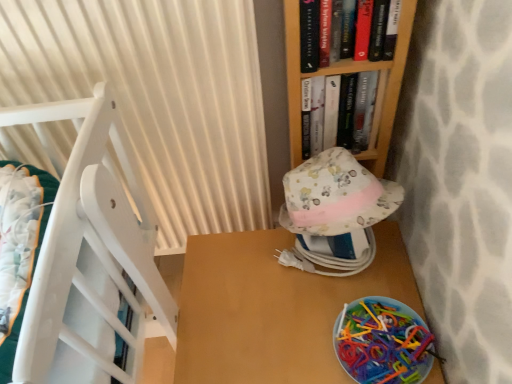
Locate an element on the screen. The image size is (512, 384). free space above wooden table at lower right (from a real-world perspective) is located at coordinates (281, 304).